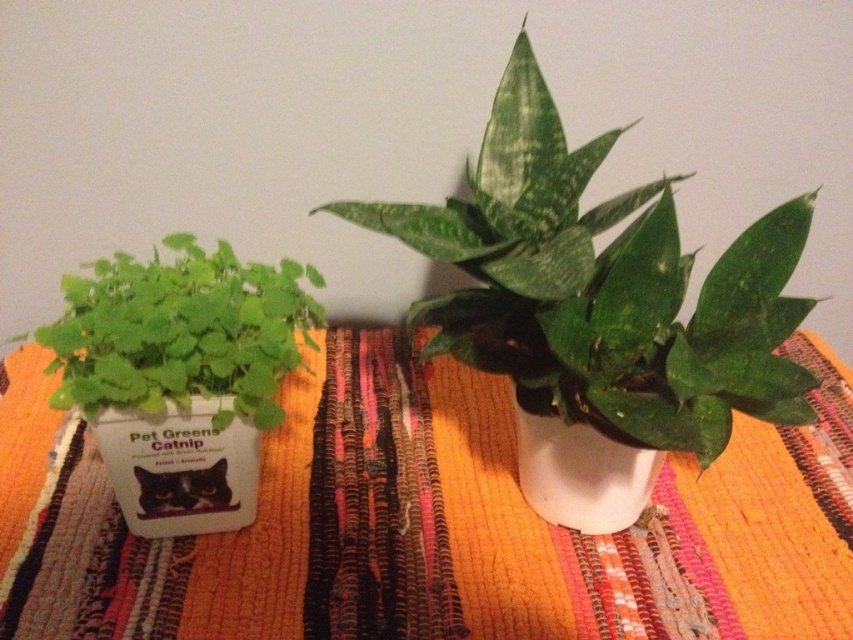
You are arranging a living room and want to place a white matte container at left on the left side of an orange woven rug at center. Is the current placement correct according to the image?

Yes, the current placement is correct because the orange woven rug at center is to the right of the white matte container at left, which matches the desired arrangement.

Consider the image. You are arranging plants on a shelf and need to know which object takes up more space. Based on the scene, which is bigger between the orange woven rug at center and the white matte container at left?

The orange woven rug at center is larger in size than the white matte container at left, so the orange woven rug at center takes up more space.

You are a delivery person who needs to place a small package between the orange woven rug at center and the white matte vase at center. The package is 8 inches long. Can you fit it in the space between them?

The space between the orange woven rug at center and the white matte vase at center is 7.24 inches. Since the package is 8 inches long, it is slightly too long to fit in the available space.